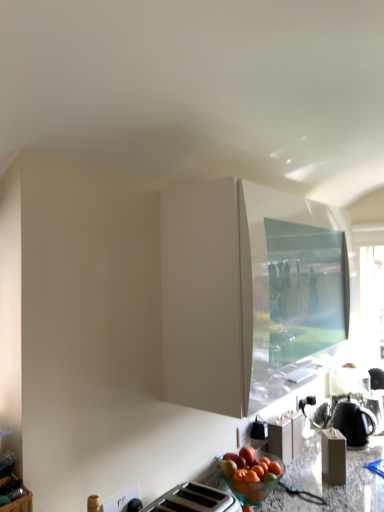
This screenshot has height=512, width=384. What are the coordinates of `black matte kettle at lower right` in the screenshot? It's located at (353, 421).

What is the approximate height of black matte kettle at lower right?

black matte kettle at lower right is 9.14 inches in height.

What do you see at coordinates (353, 421) in the screenshot? I see `black matte kettle at lower right` at bounding box center [353, 421].

Image resolution: width=384 pixels, height=512 pixels. What do you see at coordinates (249, 293) in the screenshot? I see `white glossy cabinet at upper center` at bounding box center [249, 293].

The width and height of the screenshot is (384, 512). I want to click on white glossy cabinet at upper center, so click(x=249, y=293).

Identify the location of black matte kettle at lower right. click(353, 421).

Which is more to the left, white glossy cabinet at upper center or black matte kettle at lower right?

Positioned to the left is white glossy cabinet at upper center.

Is the position of white glossy cabinet at upper center less distant than that of black matte kettle at lower right?

Yes, white glossy cabinet at upper center is in front of black matte kettle at lower right.

Does point (242, 286) lie in front of point (356, 436)?

Yes.

From the image's perspective, is white glossy cabinet at upper center above black matte kettle at lower right?

Yes, from the image's perspective, white glossy cabinet at upper center is on top of black matte kettle at lower right.

From a real-world perspective, which object rests below the other?

black matte kettle at lower right, from a real-world perspective.

Considering the sizes of objects white glossy cabinet at upper center and black matte kettle at lower right in the image provided, who is thinner, white glossy cabinet at upper center or black matte kettle at lower right?

black matte kettle at lower right is thinner.

Looking at this image, considering the relative sizes of white glossy cabinet at upper center and black matte kettle at lower right in the image provided, is white glossy cabinet at upper center shorter than black matte kettle at lower right?

No, white glossy cabinet at upper center is not shorter than black matte kettle at lower right.

Consider the image. Considering the sizes of white glossy cabinet at upper center and black matte kettle at lower right in the image, is white glossy cabinet at upper center bigger or smaller than black matte kettle at lower right?

Considering their sizes, white glossy cabinet at upper center takes up more space than black matte kettle at lower right.

Is black matte kettle at lower right a part of white glossy cabinet at upper center?

No, black matte kettle at lower right is not inside white glossy cabinet at upper center.

Are white glossy cabinet at upper center and black matte kettle at lower right making contact?

white glossy cabinet at upper center and black matte kettle at lower right are clearly separated.

Is black matte kettle at lower right at the back of white glossy cabinet at upper center?

white glossy cabinet at upper center does not have its back to black matte kettle at lower right.

At what (x,y) coordinates should I click in order to perform the action: click on cabinetry above the black matte kettle at lower right (from a real-world perspective). Please return your answer as a coordinate pair (x, y). Looking at the image, I should click on (249, 293).

Can you confirm if black matte kettle at lower right is positioned to the left of white glossy cabinet at upper center?

In fact, black matte kettle at lower right is to the right of white glossy cabinet at upper center.

Does black matte kettle at lower right come behind white glossy cabinet at upper center?

That is True.

Considering the positions of point (357, 436) and point (192, 244), is point (357, 436) closer or farther from the camera than point (192, 244)?

Point (357, 436) appears to be farther away from the viewer than point (192, 244).

From the image's perspective, is black matte kettle at lower right on white glossy cabinet at upper center?

Incorrect, from the image's perspective, black matte kettle at lower right is lower than white glossy cabinet at upper center.

From a real-world perspective, is black matte kettle at lower right located higher than white glossy cabinet at upper center?

No.

Between black matte kettle at lower right and white glossy cabinet at upper center, which one has smaller width?

With smaller width is black matte kettle at lower right.

Which of these two, black matte kettle at lower right or white glossy cabinet at upper center, stands taller?

With more height is white glossy cabinet at upper center.

Which of these two, black matte kettle at lower right or white glossy cabinet at upper center, is smaller?

black matte kettle at lower right.

Would you say black matte kettle at lower right is outside white glossy cabinet at upper center?

Yes, black matte kettle at lower right is located beyond the bounds of white glossy cabinet at upper center.

Is black matte kettle at lower right next to white glossy cabinet at upper center?

black matte kettle at lower right and white glossy cabinet at upper center are clearly separated.

Is white glossy cabinet at upper center at the back of black matte kettle at lower right?

No.

Can you tell me how much black matte kettle at lower right and white glossy cabinet at upper center differ in facing direction?

The angle between the facing direction of black matte kettle at lower right and the facing direction of white glossy cabinet at upper center is 90 degrees.

Measure the distance from black matte kettle at lower right to white glossy cabinet at upper center.

A distance of 31.65 inches exists between black matte kettle at lower right and white glossy cabinet at upper center.

Find the location of a particular element. kettle on the right of white glossy cabinet at upper center is located at coordinates (353, 421).

You are a GUI agent. You are given a task and a screenshot of the screen. Output one action in this format:
    pyautogui.click(x=<x>, y=<y>)
    Task: Click on the cabinetry in front of the black matte kettle at lower right
    The height and width of the screenshot is (512, 384).
    Given the screenshot: What is the action you would take?
    pyautogui.click(x=249, y=293)

I want to click on cabinetry that appears above the black matte kettle at lower right (from the image's perspective), so click(x=249, y=293).